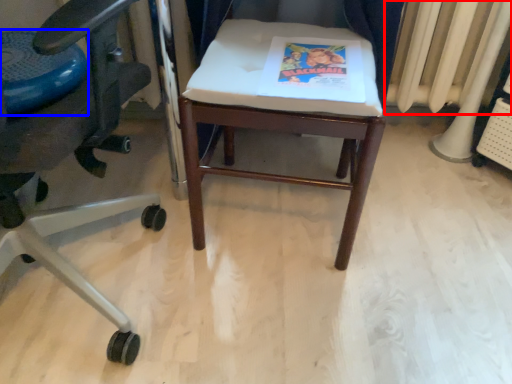
Question: Which point is closer to the camera, radiator (highlighted by a red box) or round table (highlighted by a blue box)?

Choices:
 (A) radiator
 (B) round table

Answer: (B)